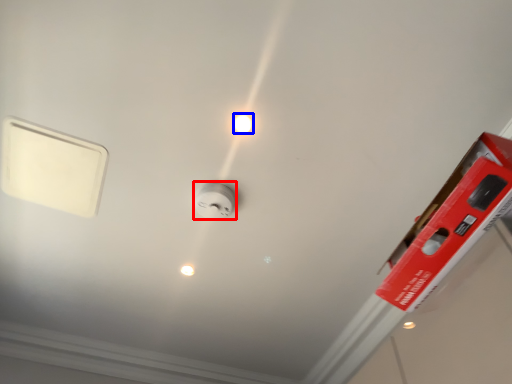
Question: Which of the following is the farthest to the observer, power plugs and sockets (highlighted by a red box) or light bulb (highlighted by a blue box)?

Choices:
 (A) power plugs and sockets
 (B) light bulb

Answer: (A)